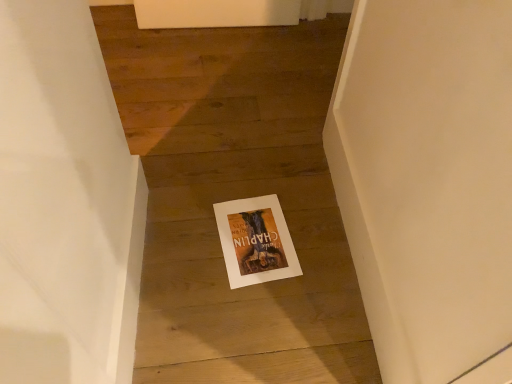
Find the location of a particular element. free space in front of white paper at center is located at coordinates (247, 312).